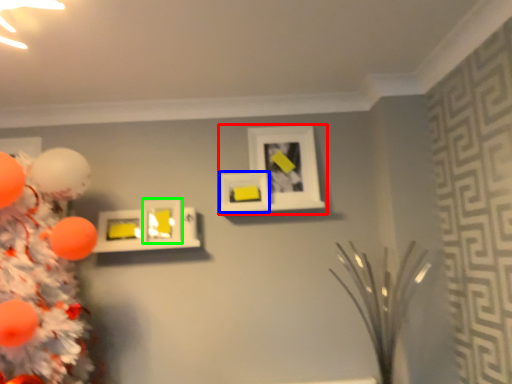
Question: Which is farther away from picture frame (highlighted by a red box)? picture frame (highlighted by a blue box) or picture frame (highlighted by a green box)?

Choices:
 (A) picture frame
 (B) picture frame

Answer: (B)